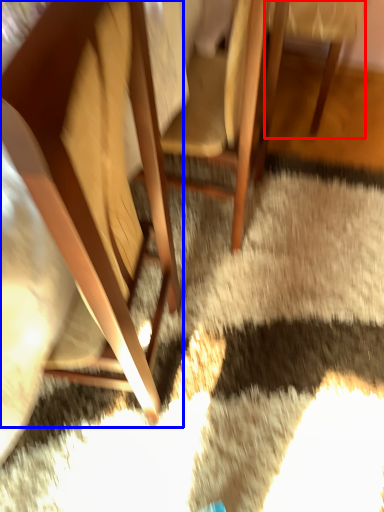
Question: Which object appears closest to the camera in this image, chair (highlighted by a red box) or chair (highlighted by a blue box)?

Choices:
 (A) chair
 (B) chair

Answer: (B)